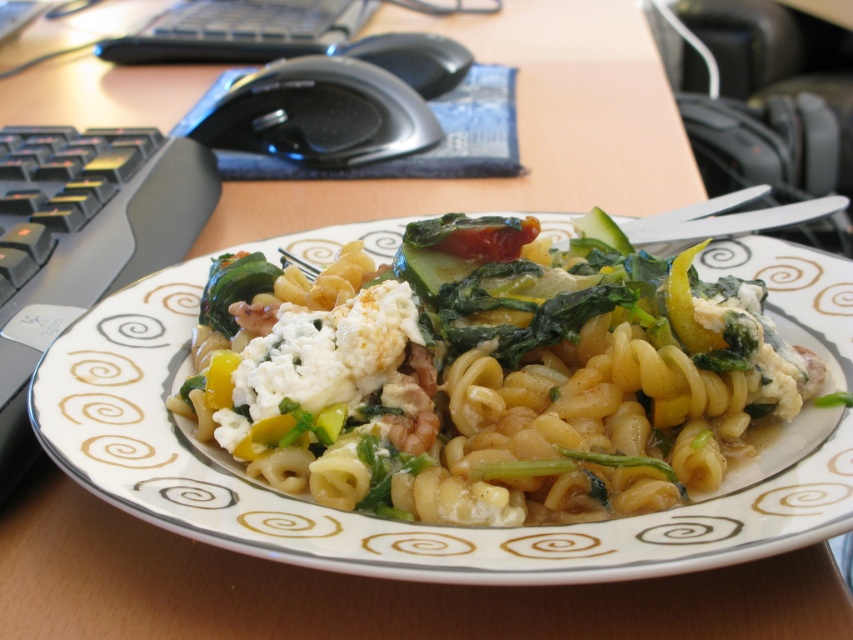
Where is the yellow matte pasta at center located in the image?

The yellow matte pasta at center is located at point [495,384].

You are a food critic who needs to describe the arrangement of the dish. How far apart are the yellow matte pasta at center and the green leafy vegetable at center?

The distance between the yellow matte pasta at center and the green leafy vegetable at center is 9.38 inches.

You are a food critic evaluating this pasta dish. You notice both the white crumbly cheese at center and the green leafy vegetable at center. Which of these two items is closer to you when looking at the dish?

The white crumbly cheese at center is closer to you because it is in front of the green leafy vegetable at center in the dish.